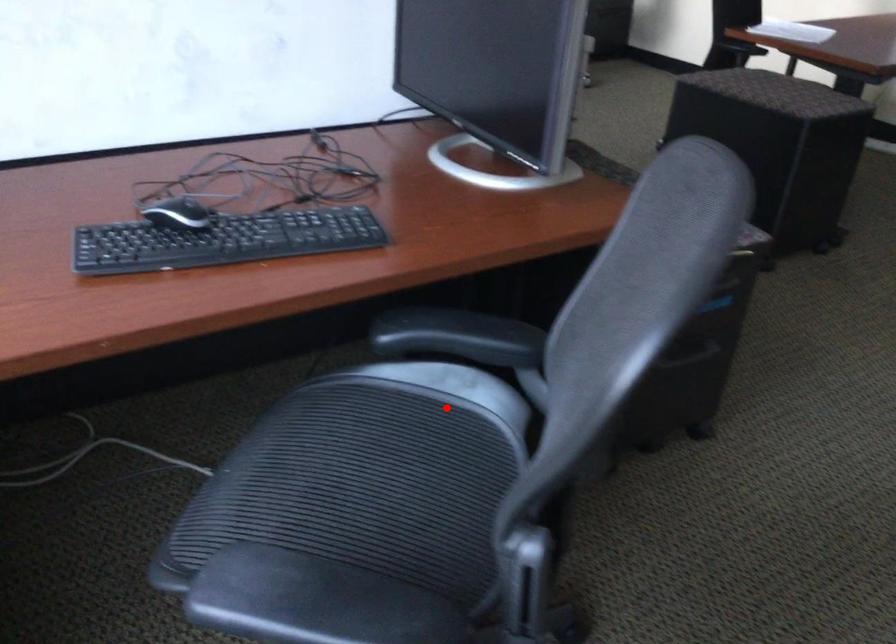
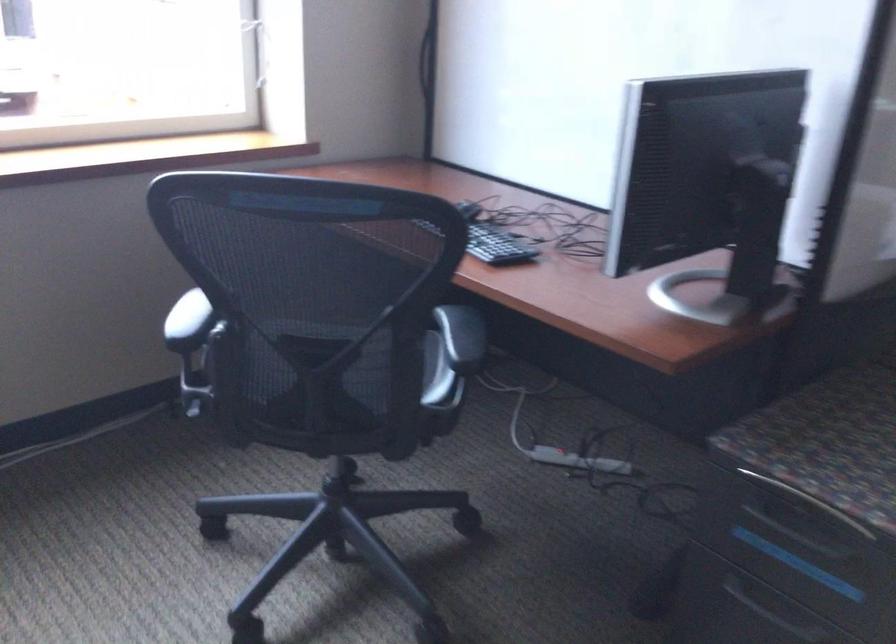
Question: I am providing you with two images of the same scene from different viewpoints. Image1 has a red point marked. In image2, the corresponding 3D location appears at what relative position? Reply with the corresponding letter.

Choices:
 (A) Closer
 (B) Farther

Answer: (B)